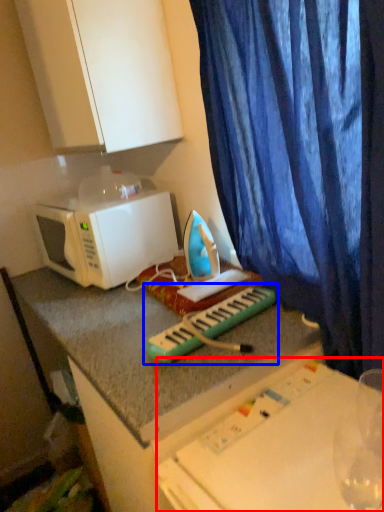
Question: Which object appears closest to the camera in this image, table (highlighted by a red box) or musical keyboard (highlighted by a blue box)?

Choices:
 (A) table
 (B) musical keyboard

Answer: (A)